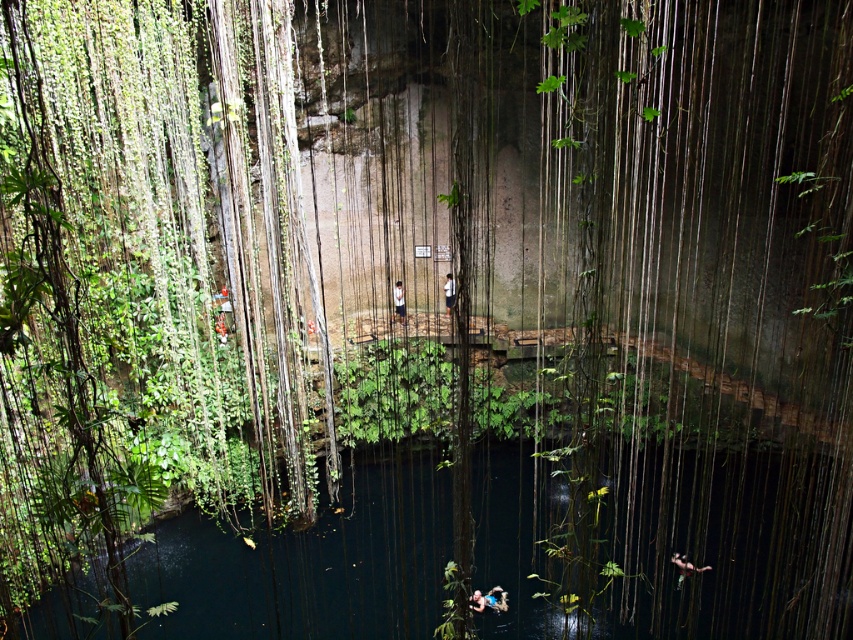
You are a visitor at the cenote and want to take a photo of the light blue shirt at center and the dark blue water at center. Based on their positions, which object should you focus on first if you want both to be in the frame?

The dark blue water at center is to the right of the light blue shirt at center, so you should focus on the light blue shirt at center first to ensure both are in the frame.